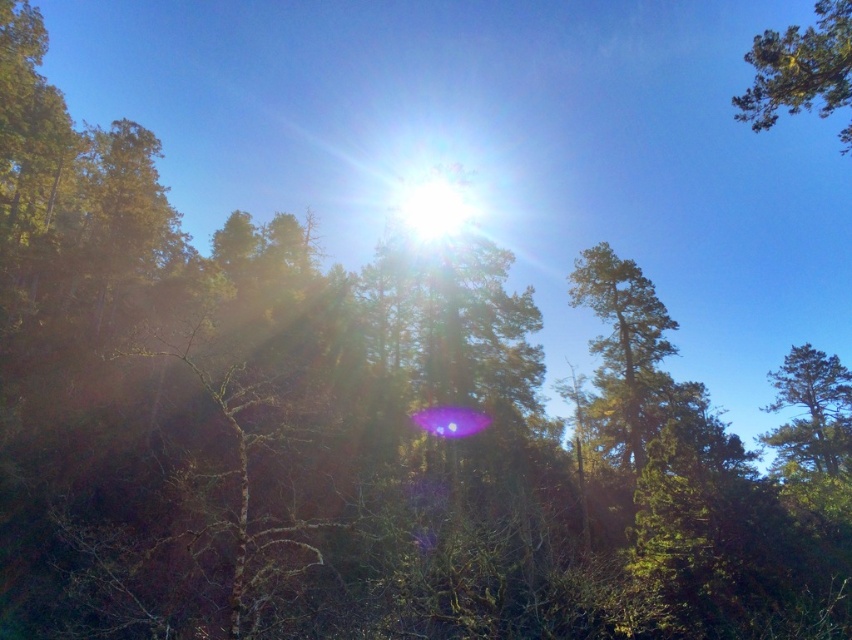
Does green textured tree at upper right appear over green leafy tree at right?

Yes.

Is green textured tree at upper right bigger than green leafy tree at right?

Indeed, green textured tree at upper right has a larger size compared to green leafy tree at right.

Which is in front, point (833, 16) or point (798, 417)?

Point (833, 16)

Where is `green textured tree at upper right`? The height and width of the screenshot is (640, 852). green textured tree at upper right is located at coordinates [x=799, y=68].